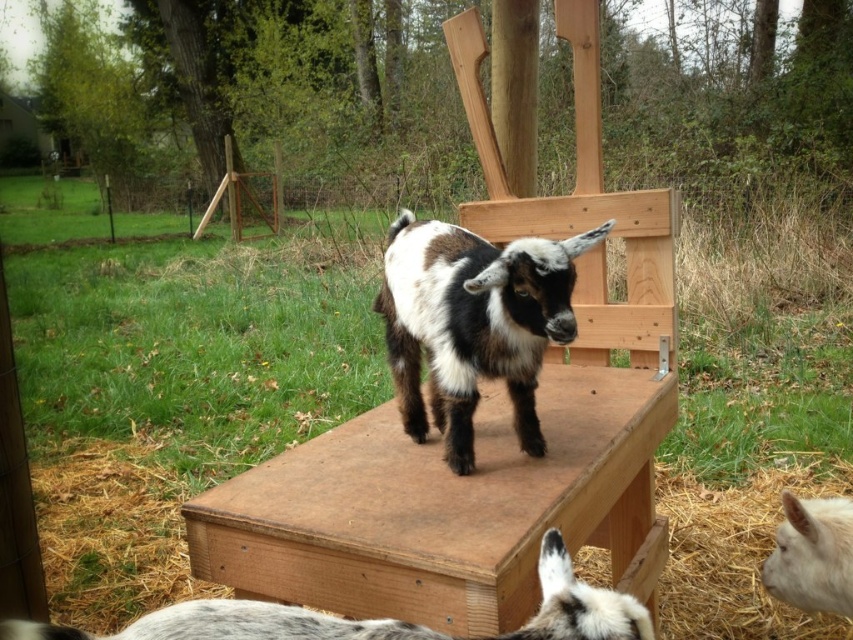
Question: Based on their relative distances, which object is farther from the straw at lower right?

Choices:
 (A) white speckled fur goat at lower center
 (B) spotted fur goat at center

Answer: (A)

Question: Which object is closer to the camera taking this photo?

Choices:
 (A) white speckled fur goat at lower center
 (B) spotted fur goat at center

Answer: (A)

Question: Which of these objects is positioned farthest from the white woolen goat at lower right?

Choices:
 (A) straw at lower right
 (B) white speckled fur goat at lower center

Answer: (A)

Question: Is straw at lower right smaller than white woolen goat at lower right?

Choices:
 (A) yes
 (B) no

Answer: (B)

Question: Can you confirm if white speckled fur goat at lower center is positioned to the right of white woolen goat at lower right?

Choices:
 (A) yes
 (B) no

Answer: (B)

Question: Is straw at lower right wider than white woolen goat at lower right?

Choices:
 (A) yes
 (B) no

Answer: (A)